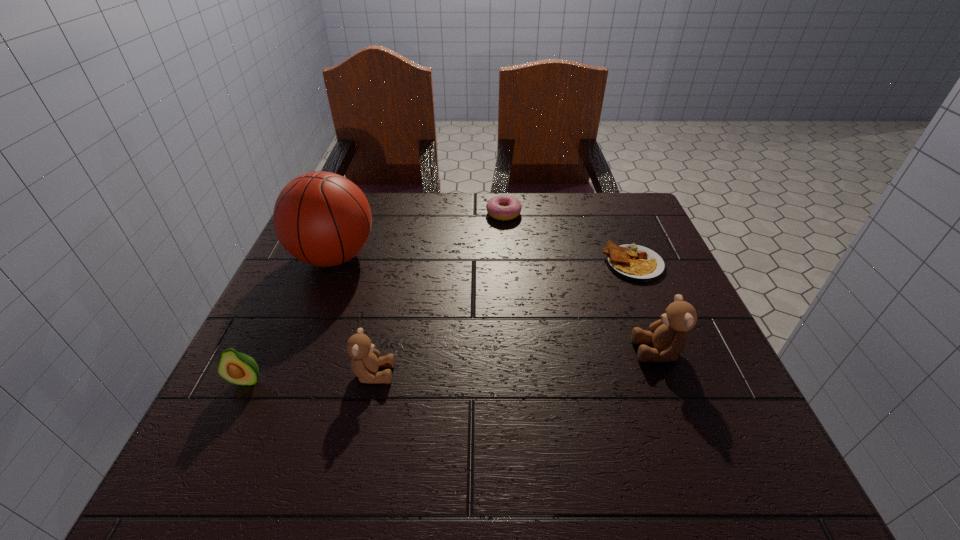
At what (x,y) coordinates should I click in order to perform the action: click on vacant area between the left teddy bear and the avocado. Please return your answer as a coordinate pair (x, y). The image size is (960, 540). Looking at the image, I should click on (310, 377).

Where is `free spot between the shorter teddy bear and the farthest object`? The image size is (960, 540). free spot between the shorter teddy bear and the farthest object is located at coordinates (439, 294).

What are the coordinates of `object that stands as the fifth closest to the fifth tallest object` in the screenshot? It's located at (238, 368).

Point out which object is positioned as the fourth nearest to the tallest object. Please provide its 2D coordinates. Your answer should be formatted as a tuple, i.e. [(x, y)], where the tuple contains the x and y coordinates of a point satisfying the conditions above.

[(632, 262)]

The height and width of the screenshot is (540, 960). Find the location of `blank area in the image that satisfies the following two spatial constraints: 1. on the face of the third object from left to right; 2. on the cut side of the avocado`. blank area in the image that satisfies the following two spatial constraints: 1. on the face of the third object from left to right; 2. on the cut side of the avocado is located at coordinates (372, 380).

You are a GUI agent. You are given a task and a screenshot of the screen. Output one action in this format:
    pyautogui.click(x=<x>, y=<y>)
    Task: Click on the vacant area in the image that satisfies the following two spatial constraints: 1. on the face of the fifth shortest object; 2. on the cut side of the avocado
    The width and height of the screenshot is (960, 540).
    Given the screenshot: What is the action you would take?
    pyautogui.click(x=669, y=380)